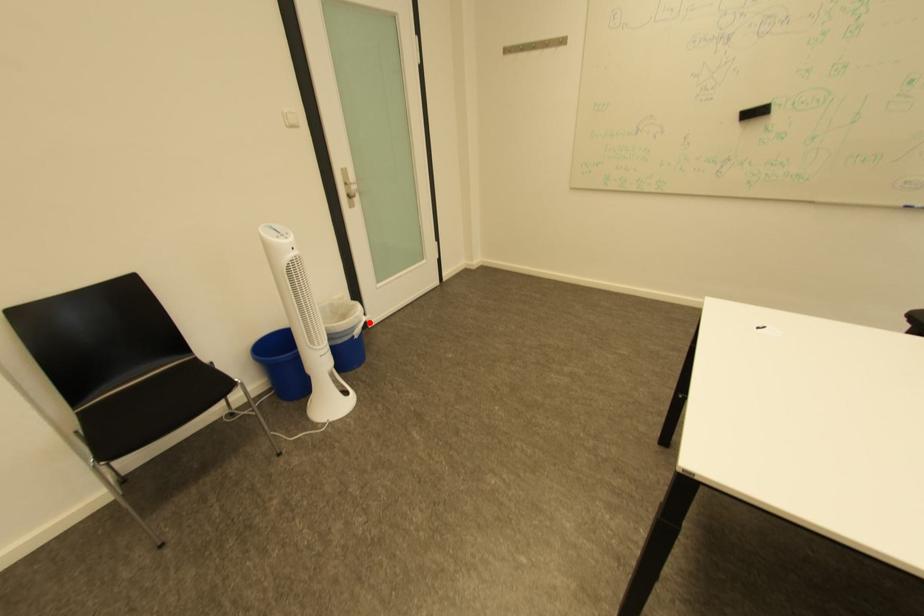
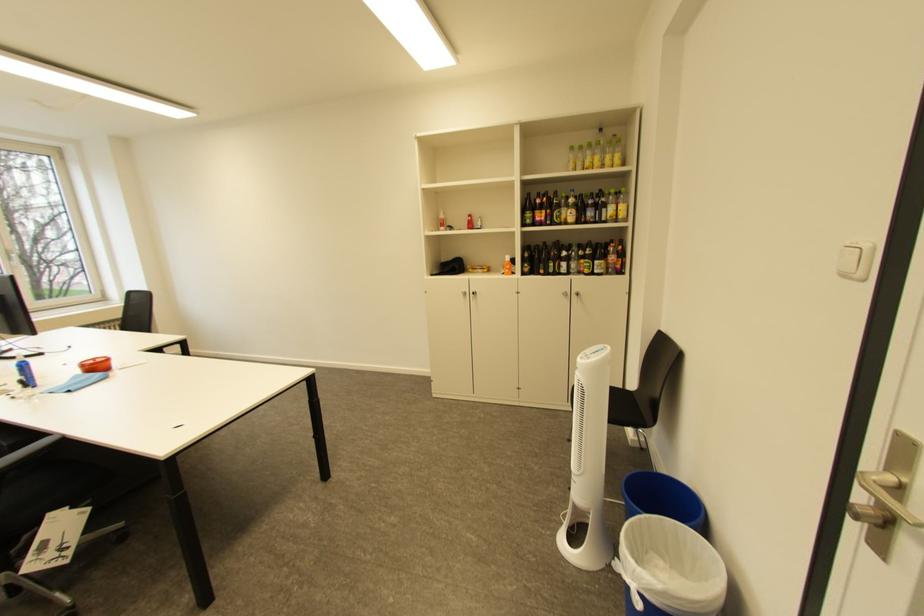
In the second image, find the point that corresponds to the highlighted location in the first image.

(636, 570)